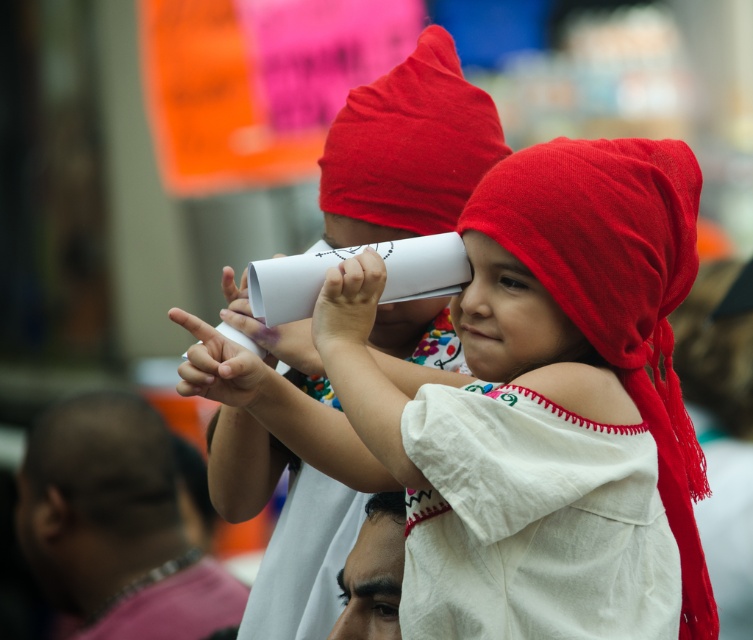
Question: Which is farther from the white fabric head at center?

Choices:
 (A) matte white paper at center
 (B) red cotton headdress at center
 (C) white soft fabric shoulder at center

Answer: (B)

Question: In this image, where is matte white paper at center located relative to red cotton headdress at center?

Choices:
 (A) right
 (B) left

Answer: (B)

Question: Which point is closer to the camera taking this photo?

Choices:
 (A) (477, 372)
 (B) (293, 476)

Answer: (A)

Question: Can you confirm if red cotton headdress at center is positioned to the left of white soft fabric shoulder at center?

Choices:
 (A) yes
 (B) no

Answer: (B)

Question: Which of the following is the farthest from the observer?

Choices:
 (A) (645, 150)
 (B) (575, 385)
 (C) (63, 548)
 (D) (392, 515)

Answer: (C)

Question: Where is matte white paper at center located in relation to bald skin at lower left in the image?

Choices:
 (A) below
 (B) above

Answer: (B)